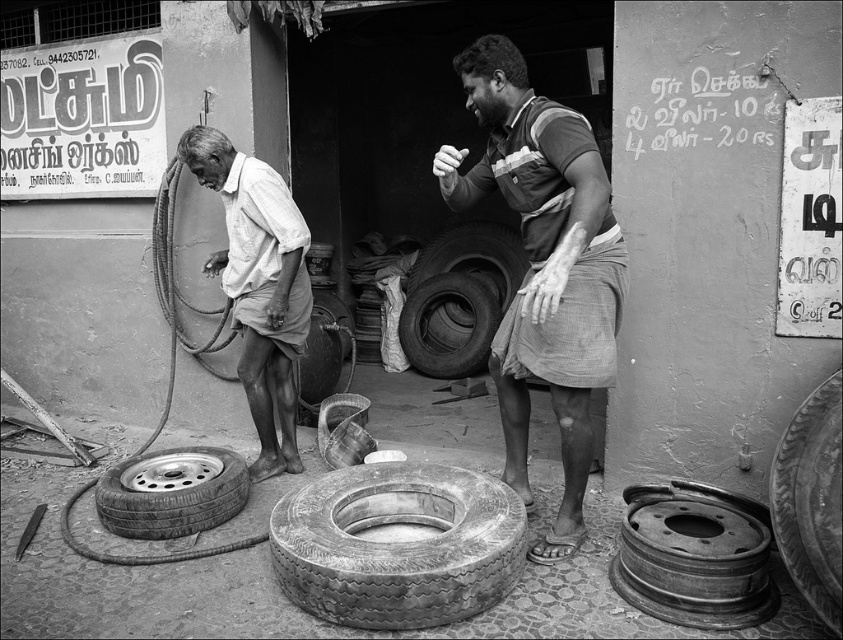
You are a delivery person who needs to place a package between the matte gray shirt at center and the worn rubber tire at center. The package is 30 inches long. Can you fit it in the space between them?

The distance between the matte gray shirt at center and the worn rubber tire at center is 28.45 inches. Since the package is 30 inches long, it is longer than the available space. Therefore, the package cannot fit between them.